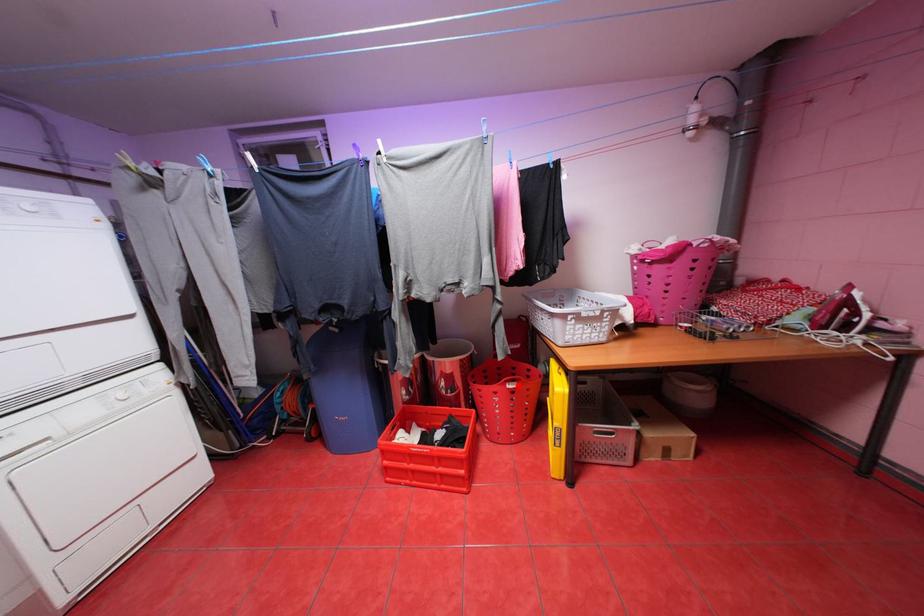
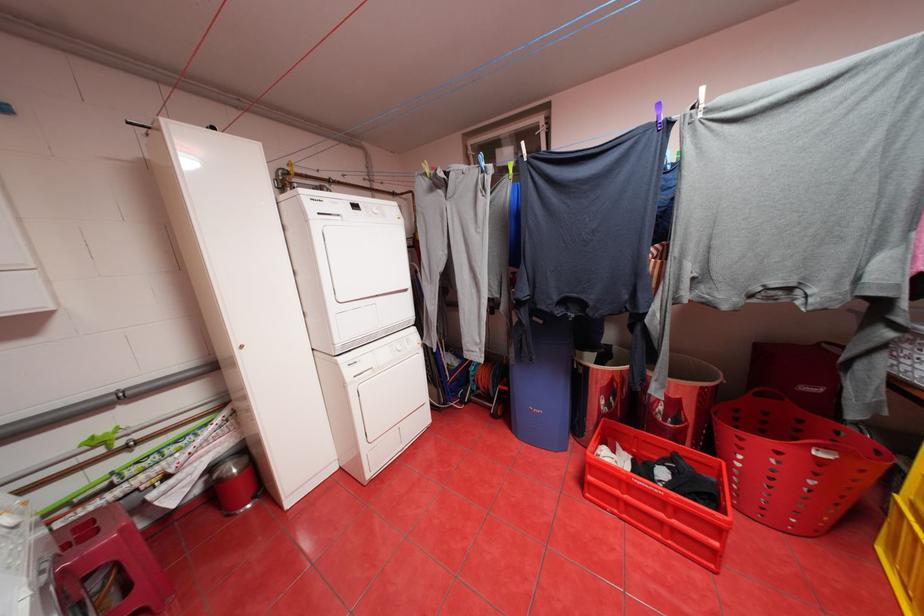
Locate, in the second image, the point that corresponds to the highlighted location in the first image.

(828, 453)